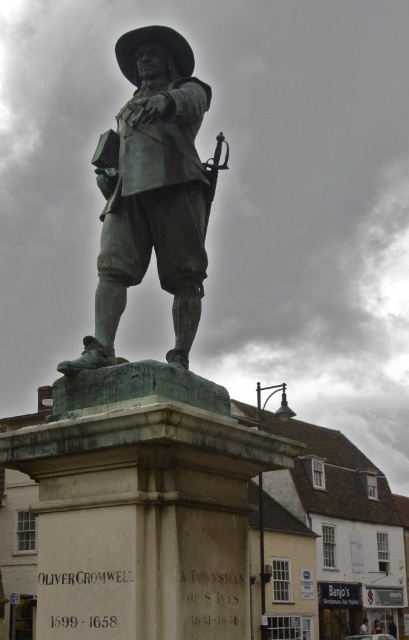
Is point (152, 204) positioned after point (211, 200)?

That is False.

Can you confirm if bronze statue at center is shorter than polished bronze rifle at upper center?

Incorrect, bronze statue at center's height does not fall short of polished bronze rifle at upper center's.

Is point (143, 104) less distant than point (209, 170)?

That is True.

Locate an element on the screen. This screenshot has width=409, height=640. bronze statue at center is located at coordinates click(152, 193).